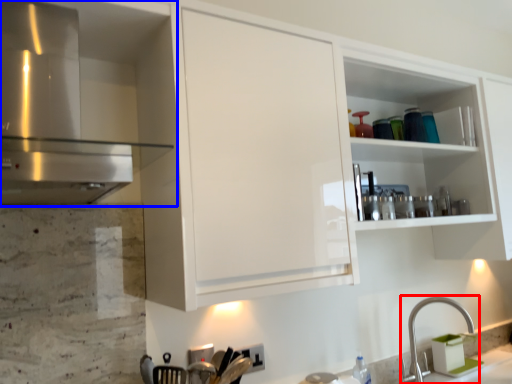
Question: Which object is further to the camera taking this photo, tap (highlighted by a red box) or cabinetry (highlighted by a blue box)?

Choices:
 (A) tap
 (B) cabinetry

Answer: (A)